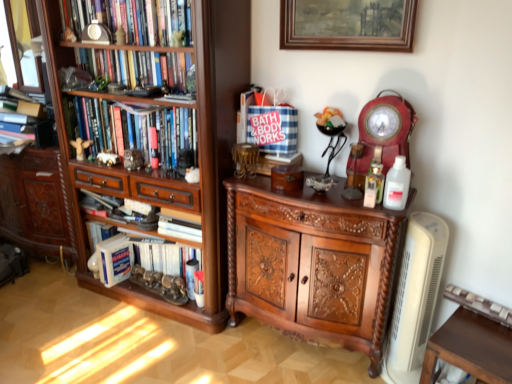
At what (x,y) coordinates should I click in order to perform the action: click on free spot above polished wood cabinet at center (from a real-world perspective). Please return your answer as a coordinate pair (x, y). The image size is (512, 384). Looking at the image, I should click on click(310, 190).